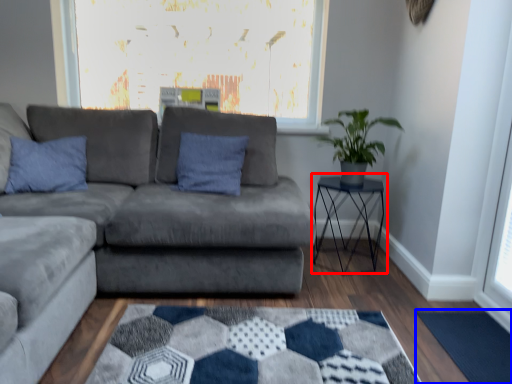
Question: Among these objects, which one is nearest to the camera, table (highlighted by a red box) or mat (highlighted by a blue box)?

Choices:
 (A) table
 (B) mat

Answer: (B)